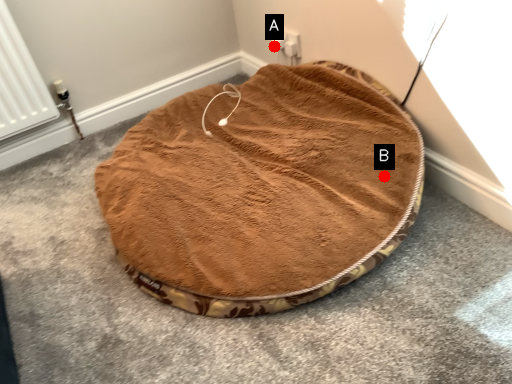
Question: Two points are circled on the image, labeled by A and B beside each circle. Among these points, which one is nearest to the camera?

Choices:
 (A) A is closer
 (B) B is closer

Answer: (B)